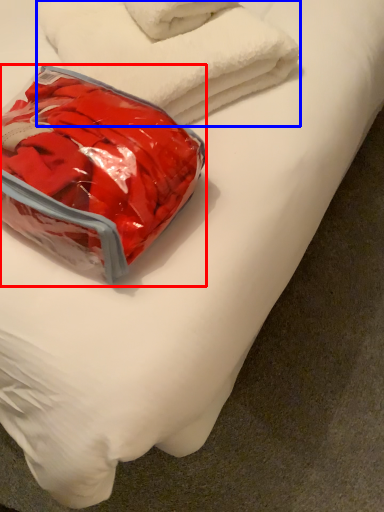
Question: Which of the following is the closest to the observer, pack (highlighted by a red box) or towel (highlighted by a blue box)?

Choices:
 (A) pack
 (B) towel

Answer: (A)